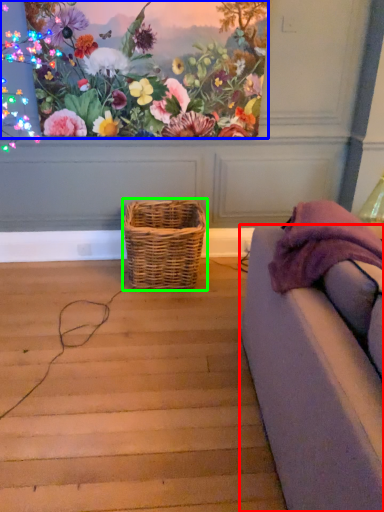
Question: Estimate the real-world distances between objects in this image. Which object is farther from studio couch (highlighted by a red box), flower (highlighted by a blue box) or picnic basket (highlighted by a green box)?

Choices:
 (A) flower
 (B) picnic basket

Answer: (A)